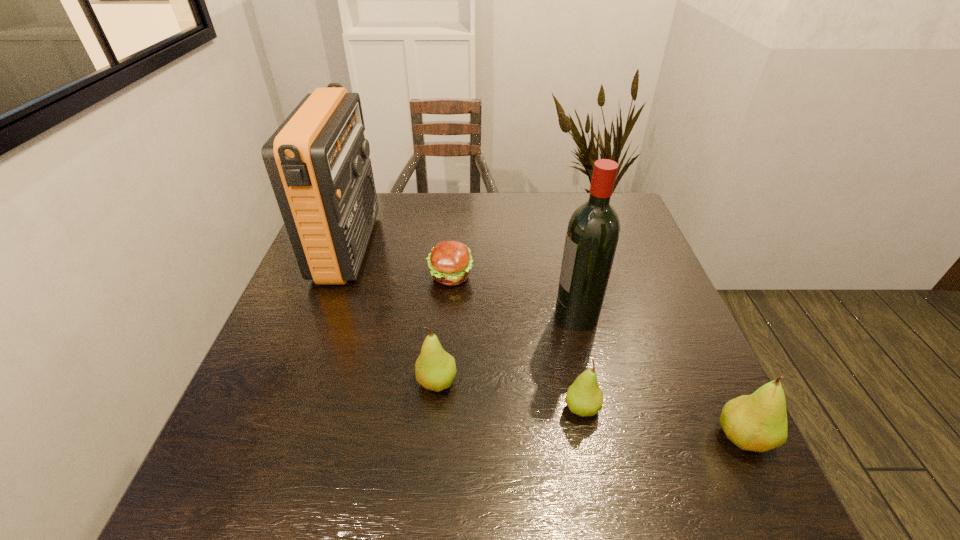
Where is `object that is positioned at the near right corner`? The image size is (960, 540). object that is positioned at the near right corner is located at coordinates (757, 422).

This screenshot has width=960, height=540. What are the coordinates of `vacant space at the far edge of the desktop` in the screenshot? It's located at (559, 217).

What are the coordinates of `free location at the near edge of the desktop` in the screenshot? It's located at (419, 435).

You are a GUI agent. You are given a task and a screenshot of the screen. Output one action in this format:
    pyautogui.click(x=<x>, y=<y>)
    Task: Click on the vacant space at the left edge of the desktop
    
    Given the screenshot: What is the action you would take?
    pyautogui.click(x=300, y=383)

Image resolution: width=960 pixels, height=540 pixels. I want to click on vacant region at the right edge, so click(637, 290).

In order to click on vacant space at the near left corner in this screenshot , I will do `click(256, 422)`.

Identify the location of vacant region between the shortest object and the rightmost object. (596, 356).

This screenshot has height=540, width=960. In order to click on free area in between the rightmost object and the wine bottle in this screenshot , I will do `click(660, 376)`.

Where is `blank region between the second pear from left to right and the leftmost pear`? This screenshot has width=960, height=540. blank region between the second pear from left to right and the leftmost pear is located at coordinates (509, 395).

I want to click on free spot between the wine bottle and the rightmost pear, so click(660, 376).